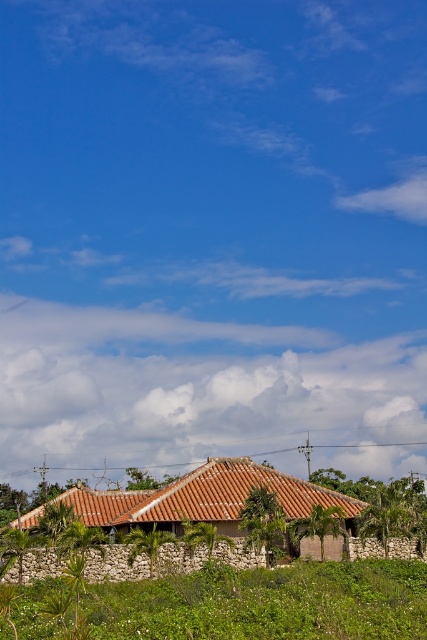
Does green leafy vegetation at lower center have a greater height compared to brown clay roof at center?

Yes.

Can you confirm if green leafy vegetation at lower center is bigger than brown clay roof at center?

Correct, green leafy vegetation at lower center is larger in size than brown clay roof at center.

Where is `green leafy vegetation at lower center`? The height and width of the screenshot is (640, 427). green leafy vegetation at lower center is located at coordinates (266, 604).